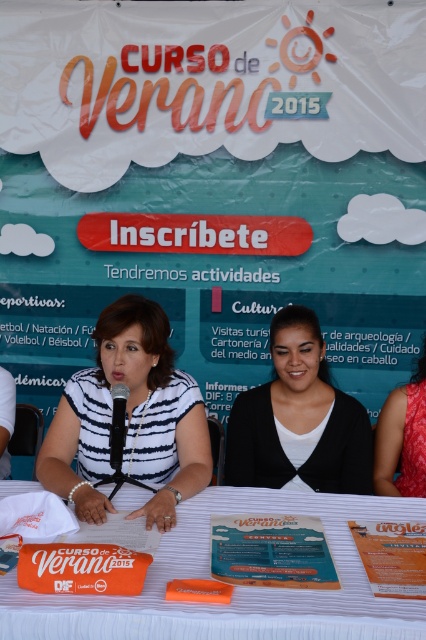
Question: Among these points, which one is nearest to the camera?

Choices:
 (A) (6, 448)
 (B) (296, 461)
 (C) (112, 419)

Answer: (C)

Question: Considering the real-world distances, which object is farthest from the matte black sweater at center?

Choices:
 (A) white striped shirt at left
 (B) white fabric table at center

Answer: (A)

Question: Is red satin dress at right below white striped shirt at left?

Choices:
 (A) no
 (B) yes

Answer: (A)

Question: Which of these objects is positioned farthest from the red satin dress at right?

Choices:
 (A) white striped shirt at center
 (B) matte black sweater at center

Answer: (A)

Question: From the image, what is the correct spatial relationship of white striped shirt at center in relation to black metallic microphone at center?

Choices:
 (A) right
 (B) left

Answer: (A)

Question: Does white striped shirt at center have a larger size compared to red satin dress at right?

Choices:
 (A) yes
 (B) no

Answer: (A)